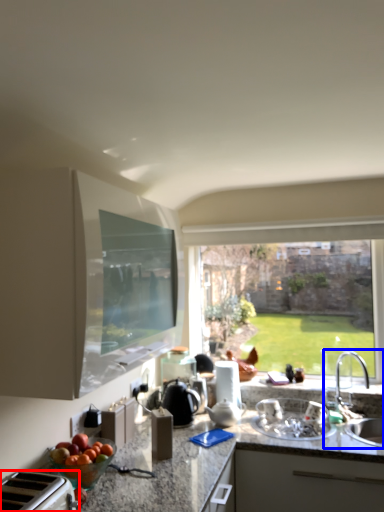
Question: Which object appears closest to the camera in this image, appliance (highlighted by a red box) or sink (highlighted by a blue box)?

Choices:
 (A) appliance
 (B) sink

Answer: (A)